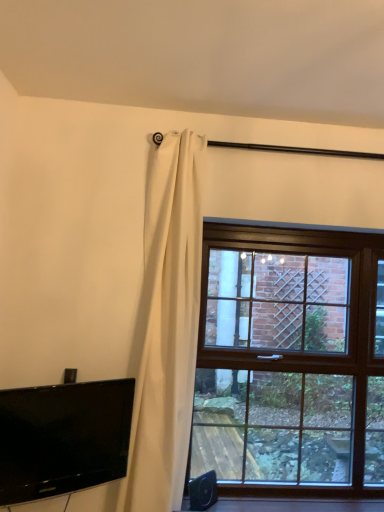
Question: Considering their positions, is brown wooden window at right located in front of or behind white matte curtain at upper left?

Choices:
 (A) behind
 (B) front

Answer: (A)

Question: From the image's perspective, is brown wooden window at right positioned above or below white matte curtain at upper left?

Choices:
 (A) above
 (B) below

Answer: (B)

Question: Which of these objects is positioned farthest from the brown wooden window at right?

Choices:
 (A) white matte curtain at upper left
 (B) black glossy tv at lower left

Answer: (B)

Question: Based on their relative distances, which object is nearer to the black glossy tv at lower left?

Choices:
 (A) brown wooden window at right
 (B) white matte curtain at upper left

Answer: (B)